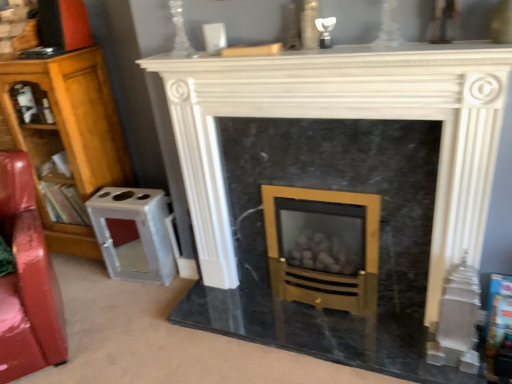
Question: Based on their sizes in the image, would you say wooden bookcase at left is bigger or smaller than glossy red swivel chair at left?

Choices:
 (A) big
 (B) small

Answer: (A)

Question: Is wooden bookcase at left taller or shorter than glossy red swivel chair at left?

Choices:
 (A) tall
 (B) short

Answer: (A)

Question: Which of these objects is positioned farthest from the glossy red swivel chair at left?

Choices:
 (A) wooden bookcase at left
 (B) white marble fireplace at center

Answer: (B)

Question: Which is farther from the wooden bookcase at left?

Choices:
 (A) glossy red swivel chair at left
 (B) white marble fireplace at center

Answer: (B)